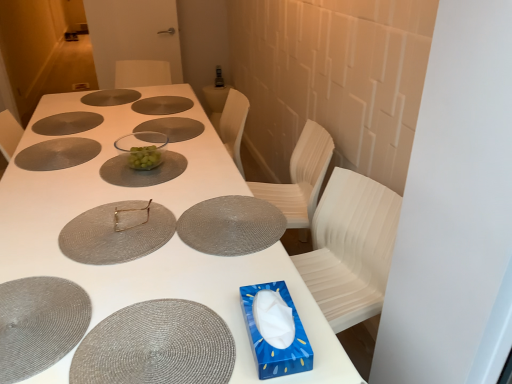
Find the location of a particular element. free space between woven gray placemat at lower left and matte gray glass plate at upper center, which ranks as the 1th glass plate in back-to-front order is located at coordinates (74, 164).